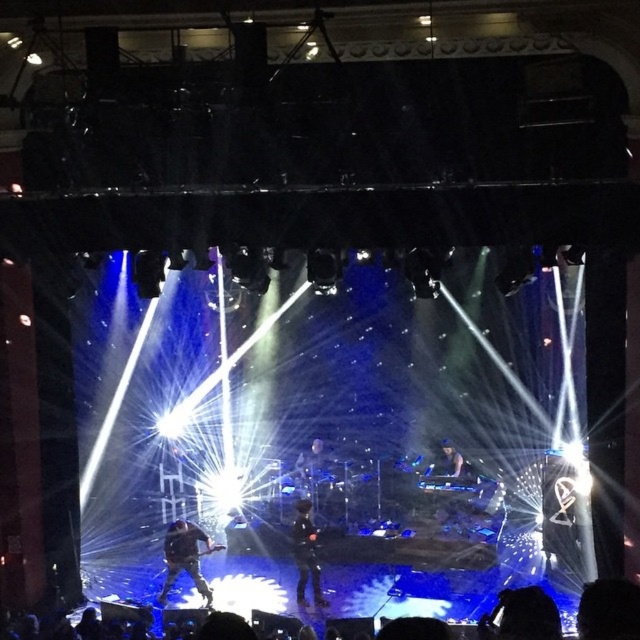
Is black leather jacket at center above black matte jacket at center?

Actually, black leather jacket at center is below black matte jacket at center.

Measure the distance from black leather jacket at center to black matte jacket at center.

black leather jacket at center and black matte jacket at center are 1.50 meters apart from each other.

Locate an element on the screen. Image resolution: width=640 pixels, height=640 pixels. black leather jacket at center is located at coordinates (184, 557).